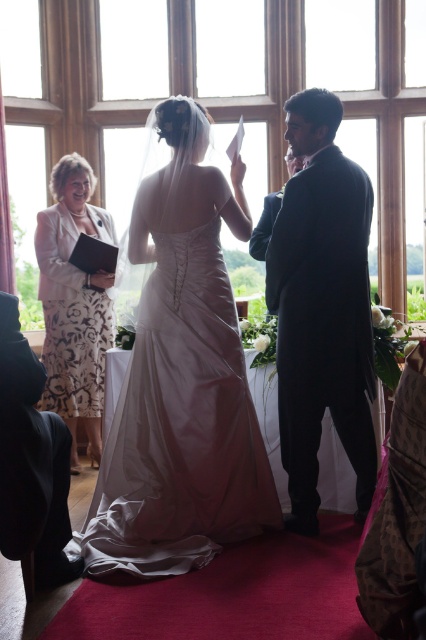
You are a photographer at the wedding ceremony. You want to capture a photo that includes both the white floral dress at left and the matte black jacket at left. Based on their positions, which one should you focus on first to ensure both are in frame?

Since the white floral dress at left is positioned to the left of the matte black jacket at left, you should focus on the white floral dress at left first to ensure both are included in the frame.

You are a photographer at the wedding. You want to take a photo of the black satin suit at center and the matte black jacket at left. Which one is positioned further away from the camera?

The matte black jacket at left is behind the black satin suit at center, so it is further away from the camera.

In the wedding scene described, where is the black satin suit at center in relation to the matte black jacket at left?

The black satin suit at center is to the right of the matte black jacket at left.